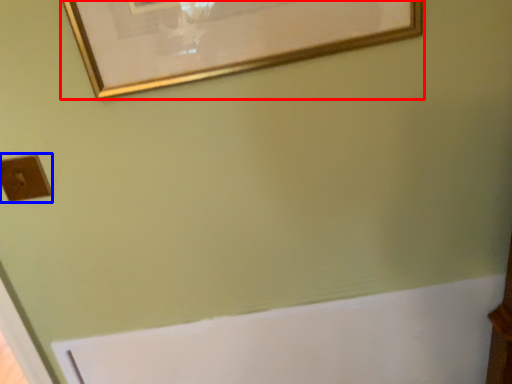
Question: Which of the following is the farthest to the observer, picture frame (highlighted by a red box) or light switch (highlighted by a blue box)?

Choices:
 (A) picture frame
 (B) light switch

Answer: (B)